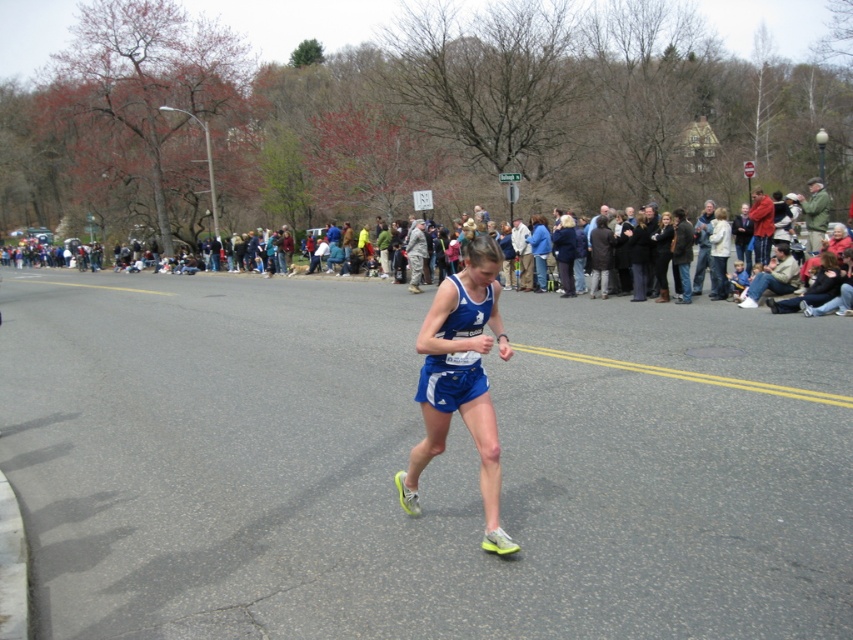
Does blue fabric shorts at center have a lesser height compared to dark clothing crowd at center?

Indeed, blue fabric shorts at center has a lesser height compared to dark clothing crowd at center.

This screenshot has height=640, width=853. What do you see at coordinates (461, 380) in the screenshot?
I see `blue fabric shorts at center` at bounding box center [461, 380].

I want to click on blue fabric shorts at center, so point(461,380).